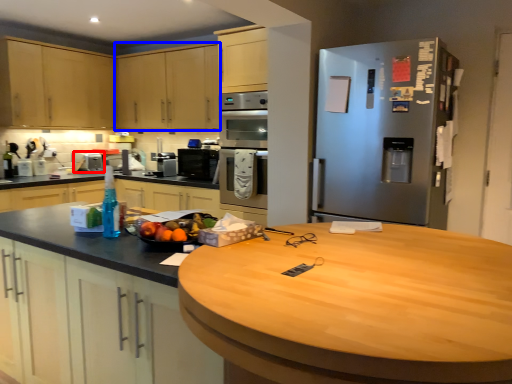
Question: Among these objects, which one is farthest to the camera, appliance (highlighted by a red box) or cabinetry (highlighted by a blue box)?

Choices:
 (A) appliance
 (B) cabinetry

Answer: (A)